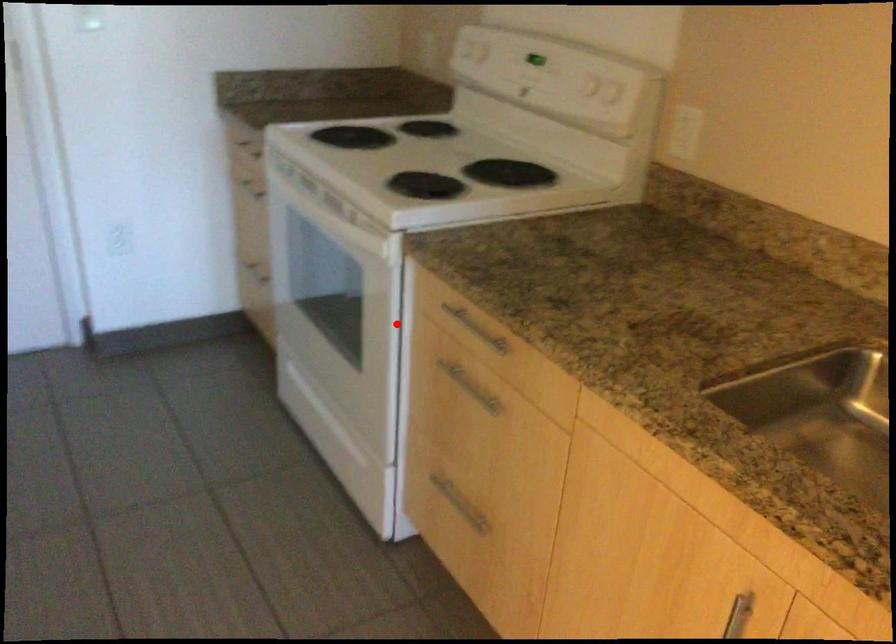
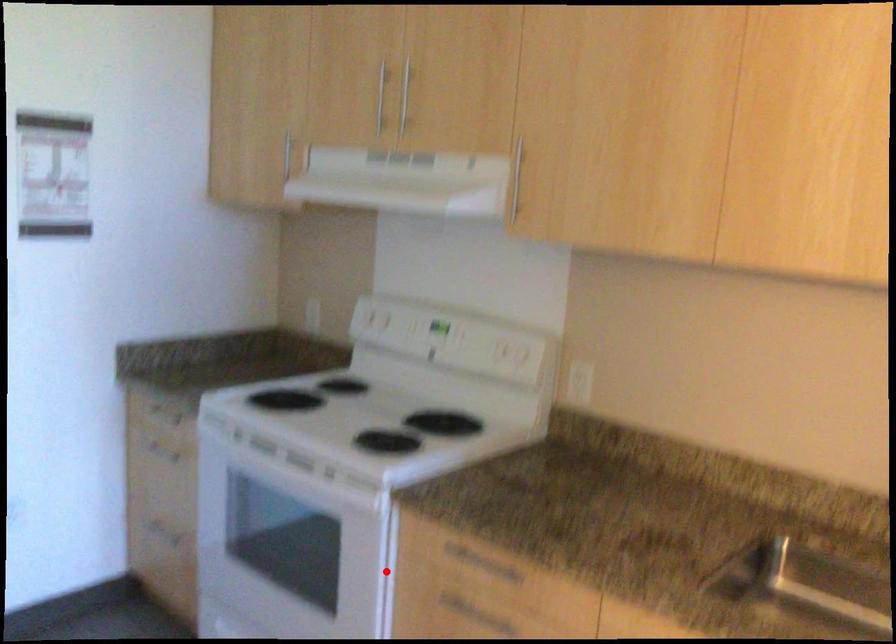
I am providing you with two images of the same scene from different viewpoints. A red point is marked on the first image and another point is marked on the second image. Is the marked point in image1 the same physical position as the marked point in image2?

Yes